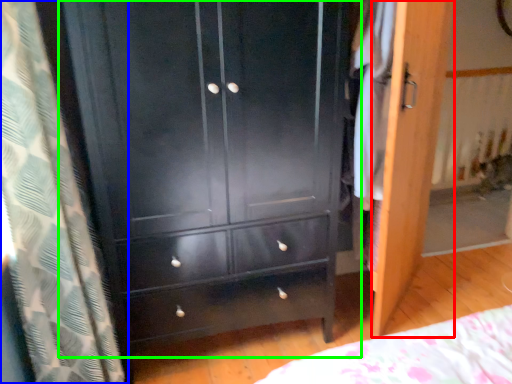
Question: Based on their relative distances, which object is nearer to screen door (highlighted by a red box)? Choose from curtain (highlighted by a blue box) and chest of drawers (highlighted by a green box).

Choices:
 (A) curtain
 (B) chest of drawers

Answer: (B)